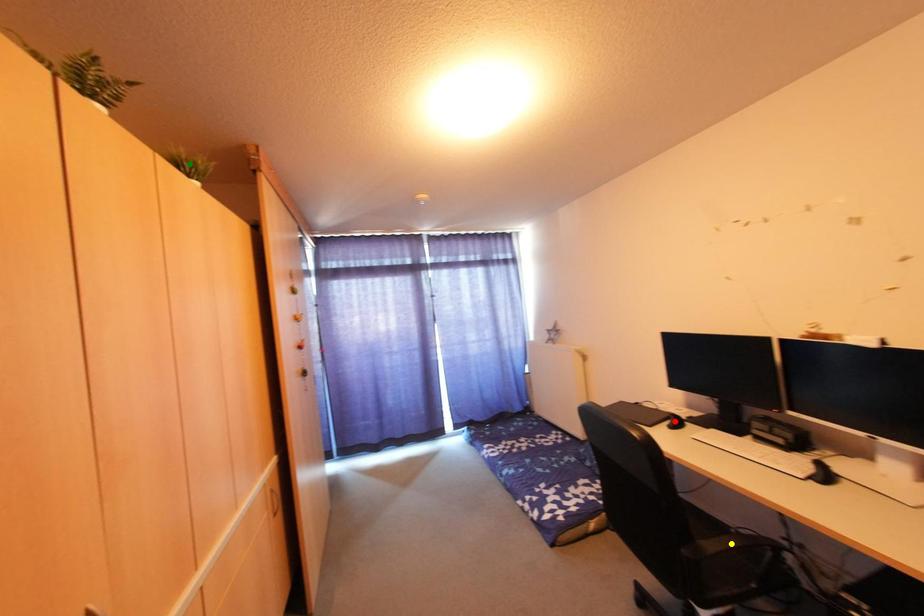
Order these from nearest to farthest:
- green point
- red point
- yellow point

1. red point
2. green point
3. yellow point